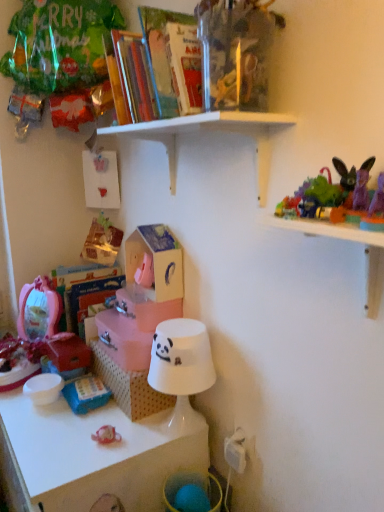
Question: From the image's perspective, is white wooden shelf at upper center, which is the 3th shelf from bottom to top, on transparent plastic toys at upper right, which is the 2th shelf in bottom-to-top order?

Choices:
 (A) yes
 (B) no

Answer: (A)

Question: Does white wooden shelf at upper center, which is the 3th shelf from bottom to top, have a smaller size compared to transparent plastic toys at upper right, which is the 2th shelf in bottom-to-top order?

Choices:
 (A) no
 (B) yes

Answer: (A)

Question: From a real-world perspective, is white wooden shelf at upper center, arranged as the first shelf when viewed from the top, physically above transparent plastic toys at upper right, arranged as the second shelf when viewed from the top?

Choices:
 (A) no
 (B) yes

Answer: (B)

Question: Would you say transparent plastic toys at upper right, which is the 2th shelf in bottom-to-top order, is part of white wooden shelf at upper center, arranged as the first shelf when viewed from the top,'s contents?

Choices:
 (A) no
 (B) yes

Answer: (A)

Question: Is white wooden shelf at upper center, which is the 3th shelf from bottom to top, wider than transparent plastic toys at upper right, arranged as the second shelf when viewed from the top?

Choices:
 (A) no
 (B) yes

Answer: (B)

Question: Looking at their shapes, would you say pink fabric toy at lower left, the 2th toy from the top, is wider or thinner than plush purple rabbit at upper right, the first toy from the front?

Choices:
 (A) thin
 (B) wide

Answer: (B)

Question: Choose the correct answer: Is pink fabric toy at lower left, the third toy when ordered from right to left, inside plush purple rabbit at upper right, the 1th toy positioned from the right, or outside it?

Choices:
 (A) inside
 (B) outside

Answer: (B)

Question: In terms of size, does pink fabric toy at lower left, acting as the third toy starting from the front, appear bigger or smaller than plush purple rabbit at upper right, arranged as the third toy when viewed from the left?

Choices:
 (A) small
 (B) big

Answer: (B)

Question: From the image's perspective, relative to plush purple rabbit at upper right, which is counted as the third toy, starting from the bottom, is pink fabric toy at lower left, acting as the first toy starting from the left, above or below?

Choices:
 (A) below
 (B) above

Answer: (A)

Question: From the image's perspective, is white glossy lampshade at lower center, acting as the 3th shelf starting from the top, located above or below transparent plastic toys at upper right, arranged as the second shelf when viewed from the top?

Choices:
 (A) above
 (B) below

Answer: (B)

Question: Relative to transparent plastic toys at upper right, arranged as the second shelf when viewed from the top, is white glossy lampshade at lower center, which ranks as the first shelf in bottom-to-top order, in front or behind?

Choices:
 (A) behind
 (B) front

Answer: (A)

Question: From a real-world perspective, is white glossy lampshade at lower center, which ranks as the first shelf in bottom-to-top order, above or below transparent plastic toys at upper right, arranged as the second shelf when viewed from the top?

Choices:
 (A) below
 (B) above

Answer: (A)

Question: Looking at the image, does white glossy lampshade at lower center, acting as the 3th shelf starting from the top, seem bigger or smaller compared to transparent plastic toys at upper right, which is the 2th shelf in bottom-to-top order?

Choices:
 (A) small
 (B) big

Answer: (B)

Question: From a real-world perspective, is hardcover book at upper center physically located above or below white glossy lampshade at lower center, acting as the 3th shelf starting from the top?

Choices:
 (A) below
 (B) above

Answer: (B)

Question: Looking at their shapes, would you say hardcover book at upper center is wider or thinner than white glossy lampshade at lower center, which ranks as the first shelf in bottom-to-top order?

Choices:
 (A) wide
 (B) thin

Answer: (B)